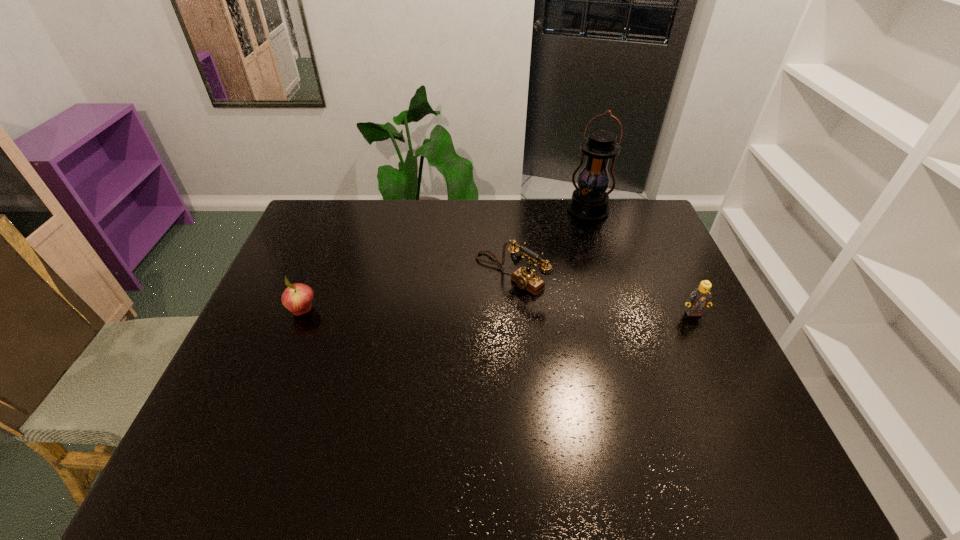
Where is `free space located 0.160m on the front-facing side of the third nearest object`? The height and width of the screenshot is (540, 960). free space located 0.160m on the front-facing side of the third nearest object is located at coordinates (444, 319).

Identify some points within the free space located above the third object from left to right, indicating its light source. Please provide its 2D coordinates. Your answer should be formatted as a tuple, i.e. [(x, y)], where the tuple contains the x and y coordinates of a point satisfying the conditions above.

[(562, 276)]

Locate the blank area located 0.290m above the third object from left to right, indicating its light source in the image. Please provide its 2D coordinates. Your answer should be formatted as a tuple, i.e. [(x, y)], where the tuple contains the x and y coordinates of a point satisfying the conditions above.

[(563, 274)]

Where can I find a free point located 0.320m above the third object from left to right, indicating its light source? Please provide its 2D coordinates. Your answer should be formatted as a tuple, i.e. [(x, y)], where the tuple contains the x and y coordinates of a point satisfying the conditions above.

[(560, 281)]

Where is `object situated at the far edge`? object situated at the far edge is located at coordinates (589, 202).

The width and height of the screenshot is (960, 540). I want to click on object positioned at the left edge, so click(x=297, y=298).

I want to click on Lego that is at the right edge, so click(700, 298).

Where is `lantern that is at the right edge`? lantern that is at the right edge is located at coordinates (589, 202).

Where is `object positioned at the far right corner`? object positioned at the far right corner is located at coordinates (589, 202).

I want to click on vacant position at the far edge of the desktop, so click(x=404, y=228).